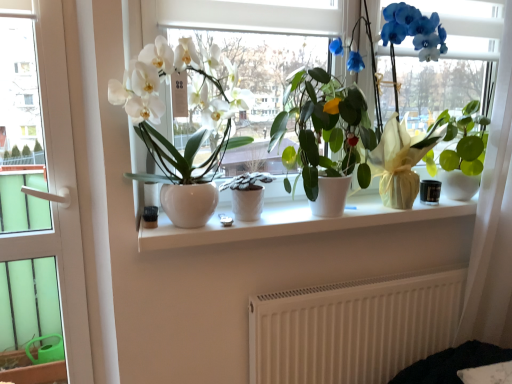
What are the coordinates of `spots to the right of white textured pot at center, the second houseplant in the left-to-right sequence` in the screenshot? It's located at (295, 216).